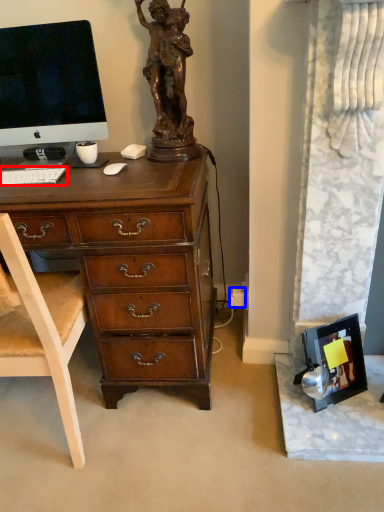
Question: Among these objects, which one is nearest to the camera, computer keyboard (highlighted by a red box) or power outlet (highlighted by a blue box)?

Choices:
 (A) computer keyboard
 (B) power outlet

Answer: (A)